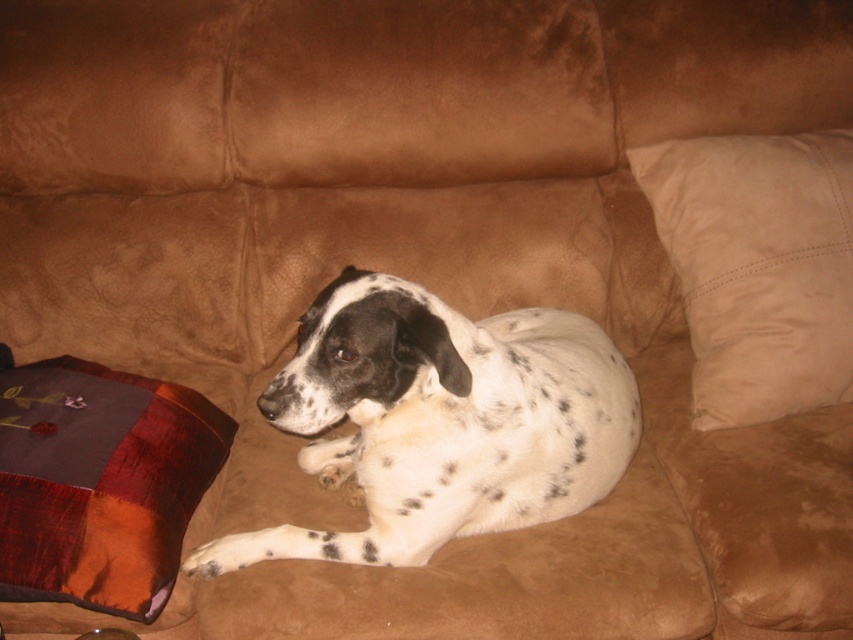
Based on the photo, which of these two, white-spotted fur at center or velvet patchwork pillow at lower left, stands taller?

white-spotted fur at center

Does white-spotted fur at center have a greater width compared to velvet patchwork pillow at lower left?

Yes.

Identify the location of white-spotted fur at center. (440, 420).

Where is `white-spotted fur at center`? white-spotted fur at center is located at coordinates (440, 420).

Measure the distance from beige suede pillow at right to velvet patchwork pillow at lower left.

34.01 inches

Is beige suede pillow at right below velvet patchwork pillow at lower left?

Incorrect, beige suede pillow at right is not positioned below velvet patchwork pillow at lower left.

The height and width of the screenshot is (640, 853). What do you see at coordinates (758, 268) in the screenshot?
I see `beige suede pillow at right` at bounding box center [758, 268].

At what (x,y) coordinates should I click in order to perform the action: click on beige suede pillow at right. Please return your answer as a coordinate pair (x, y). The height and width of the screenshot is (640, 853). Looking at the image, I should click on (758, 268).

Which of these two, white-spotted fur at center or beige suede pillow at right, stands taller?

beige suede pillow at right

Looking at this image, is white-spotted fur at center smaller than beige suede pillow at right?

No, white-spotted fur at center is not smaller than beige suede pillow at right.

Who is more forward, (456, 508) or (651, 196)?

Point (456, 508) is more forward.

Locate an element on the screen. The height and width of the screenshot is (640, 853). white-spotted fur at center is located at coordinates pos(440,420).